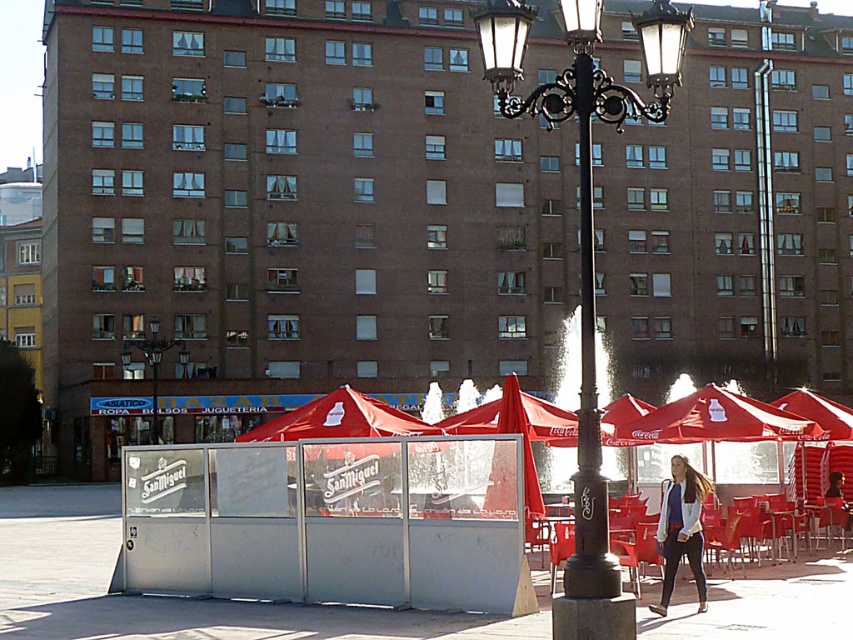
You are a delivery person trying to navigate through the plaza. You see a blue denim jacket at lower right and a metallic street light at center. Which object takes up more space in the scene?

The metallic street light at center takes up more space than the blue denim jacket at lower right.